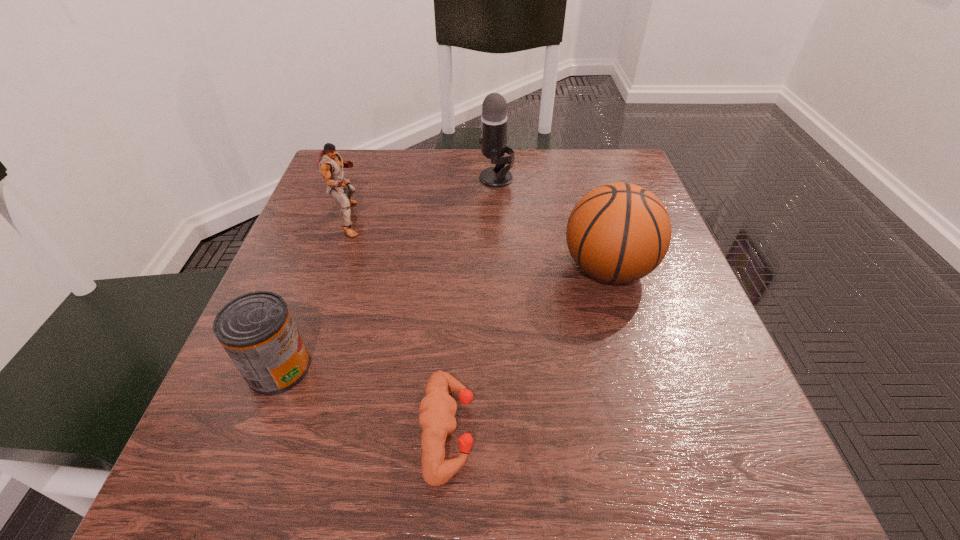
Find the location of a particular element. The width and height of the screenshot is (960, 540). free space at the far edge is located at coordinates (480, 192).

In the image, there is a desktop. At what (x,y) coordinates should I click in order to perform the action: click on vacant space at the near edge. Please return your answer as a coordinate pair (x, y). This screenshot has height=540, width=960. Looking at the image, I should click on (512, 450).

Identify the location of vacant space at the left edge of the desktop. pos(336,231).

In the image, there is a desktop. In order to click on vacant space at the far left corner in this screenshot , I will do `click(364, 201)`.

Find the location of a particular element. vacant area at the near left corner is located at coordinates (211, 499).

This screenshot has height=540, width=960. Find the location of `vacant area that lies between the basketball and the second shortest object`. vacant area that lies between the basketball and the second shortest object is located at coordinates (444, 318).

At what (x,y) coordinates should I click in order to perform the action: click on free point between the farther puncher and the farthest object. Please return your answer as a coordinate pair (x, y). Looking at the image, I should click on (423, 199).

This screenshot has width=960, height=540. In order to click on unoccupied area between the can and the left puncher in this screenshot , I will do `click(314, 294)`.

Locate an element on the screen. The height and width of the screenshot is (540, 960). free space between the farthest object and the taller puncher is located at coordinates (423, 199).

I want to click on vacant region between the rightmost object and the left puncher, so click(479, 244).